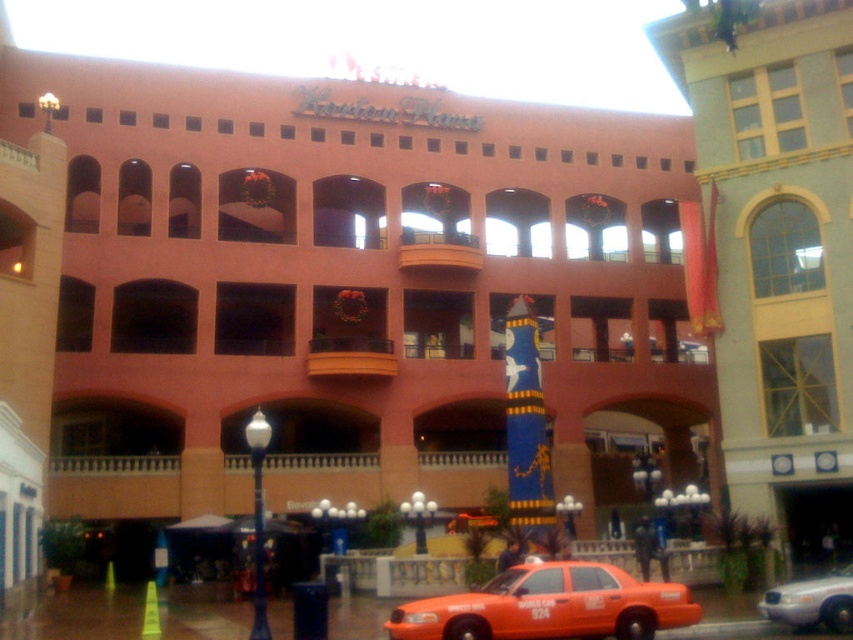
Is matte orange taxi at lower center wider than yellow textured building at right?

Yes.

Can you confirm if matte orange taxi at lower center is taller than yellow textured building at right?

Yes.

Does point (283, 224) lie in front of point (712, 148)?

No.

Find the location of a particular element. The image size is (853, 640). matte orange taxi at lower center is located at coordinates (352, 285).

Which is below, yellow textured building at right or orange matte taxi at lower center?

Positioned lower is orange matte taxi at lower center.

What do you see at coordinates (779, 257) in the screenshot?
I see `yellow textured building at right` at bounding box center [779, 257].

Identify the location of yellow textured building at right. (779, 257).

Is orange matte taxi at lower center further to camera compared to metallic silver car at lower right?

No, it is in front of metallic silver car at lower right.

Does orange matte taxi at lower center appear over metallic silver car at lower right?

Yes.

This screenshot has width=853, height=640. Identify the location of orange matte taxi at lower center. (549, 605).

At what (x,y) coordinates should I click in order to perform the action: click on orange matte taxi at lower center. Please return your answer as a coordinate pair (x, y). Image resolution: width=853 pixels, height=640 pixels. Looking at the image, I should click on (549, 605).